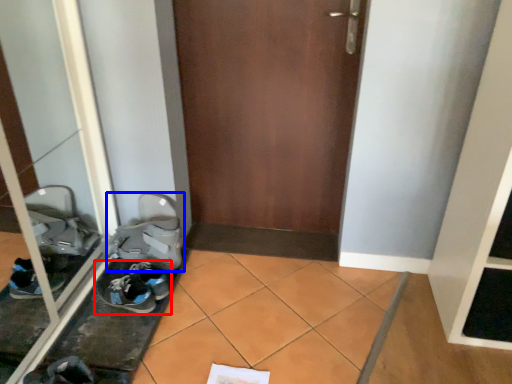
Question: Among these objects, which one is farthest to the camera, footwear (highlighted by a red box) or footwear (highlighted by a blue box)?

Choices:
 (A) footwear
 (B) footwear

Answer: (B)